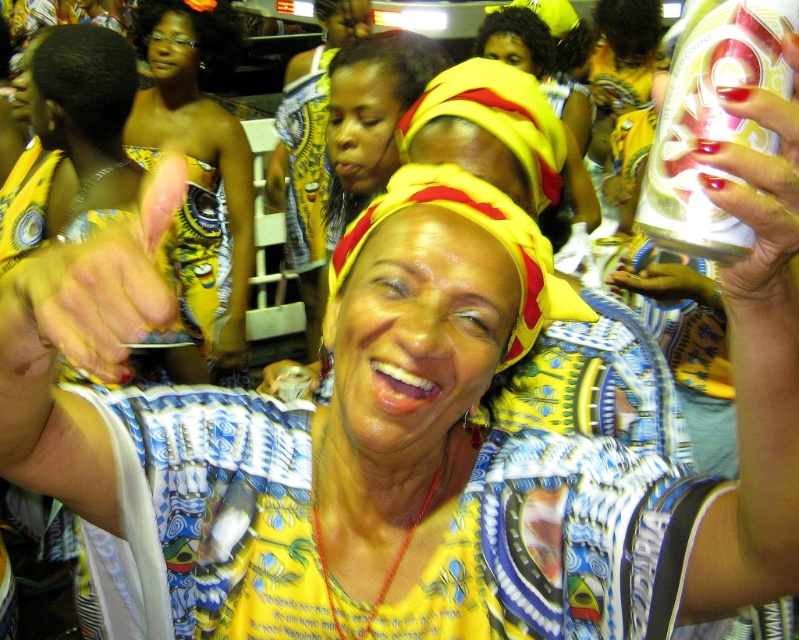
Question: Which of the following is the closest to the observer?

Choices:
 (A) (324, 179)
 (B) (670, 244)

Answer: (B)

Question: Does silver metallic can at upper right appear on the right side of yellow fabric headband at center?

Choices:
 (A) yes
 (B) no

Answer: (A)

Question: Observing the image, what is the correct spatial positioning of silver metallic can at upper right in reference to yellow fabric headband at center?

Choices:
 (A) below
 (B) above

Answer: (A)

Question: Based on their relative distances, which object is nearer to the silver metallic can at upper right?

Choices:
 (A) matte yellow headscarf at upper center
 (B) yellow fabric headband at center

Answer: (A)

Question: Can you confirm if silver metallic can at upper right is smaller than matte yellow headscarf at upper center?

Choices:
 (A) no
 (B) yes

Answer: (B)

Question: Which of these objects is positioned farthest from the matte yellow headscarf at upper center?

Choices:
 (A) yellow fabric headband at center
 (B) silver metallic can at upper right

Answer: (B)